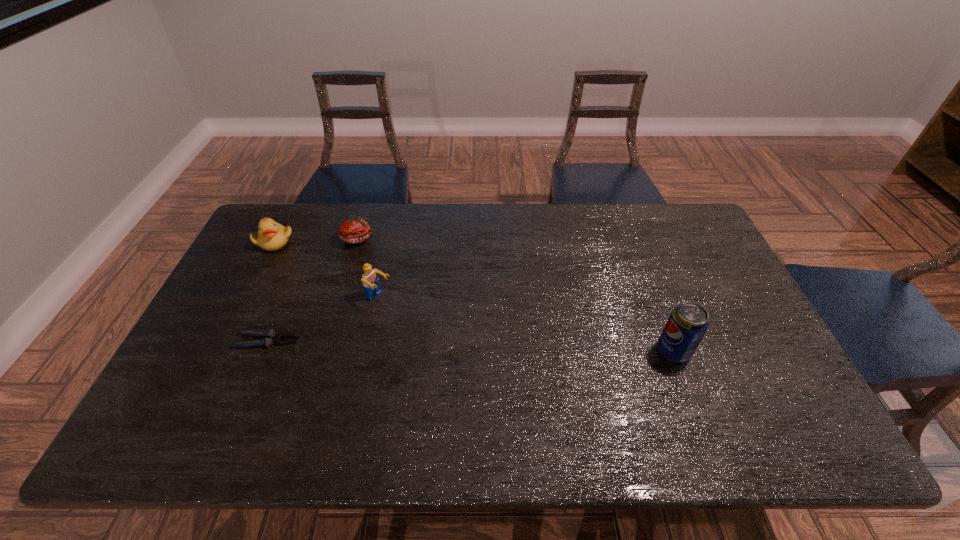
Where is `free space located 0.380m on the front-facing side of the tomato`? free space located 0.380m on the front-facing side of the tomato is located at coordinates (420, 321).

Find the location of a particular element. The height and width of the screenshot is (540, 960). free location located 0.300m on the front-facing side of the tomato is located at coordinates (407, 304).

Locate an element on the screen. free space located on the face of the second tallest object is located at coordinates (431, 329).

Locate an element on the screen. This screenshot has height=540, width=960. free spot located 0.380m on the face of the second tallest object is located at coordinates (496, 370).

Find the location of a particular element. The image size is (960, 540). vacant space located on the face of the second tallest object is located at coordinates (496, 370).

The height and width of the screenshot is (540, 960). What are the coordinates of `vacant space situated on the beak of the duckling` in the screenshot? It's located at (317, 272).

Find the location of a particular element. The height and width of the screenshot is (540, 960). blank space located 0.290m on the beak of the duckling is located at coordinates (340, 291).

Where is `free space located on the beak of the duckling`? free space located on the beak of the duckling is located at coordinates (295, 255).

This screenshot has height=540, width=960. I want to click on tomato that is at the far edge, so click(x=352, y=229).

You are a GUI agent. You are given a task and a screenshot of the screen. Output one action in this format:
    pyautogui.click(x=<x>, y=<y>)
    Task: Click on the duckling located in the far edge section of the desktop
    The image size is (960, 540).
    Given the screenshot: What is the action you would take?
    pyautogui.click(x=271, y=236)